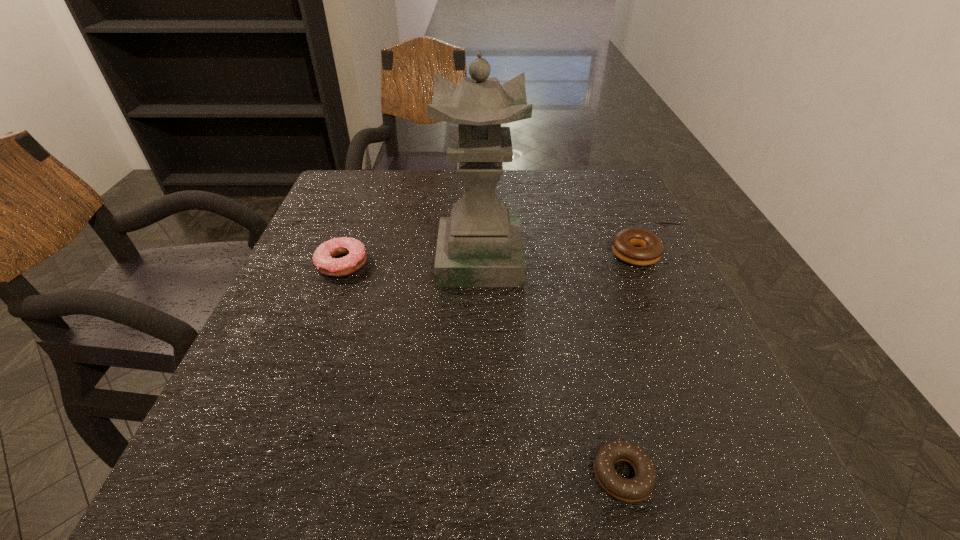
At what (x,y) coordinates should I click in order to perform the action: click on vacant area that lies between the third object from left to right and the leftmost object. Please return your answer as a coordinate pair (x, y). The height and width of the screenshot is (540, 960). Looking at the image, I should click on (483, 369).

Find the location of `unoccupied position between the nearest object and the leftmost doughnut`. unoccupied position between the nearest object and the leftmost doughnut is located at coordinates (483, 369).

Where is `vacant area that lies between the leftmost doughnut and the shortest object`? This screenshot has height=540, width=960. vacant area that lies between the leftmost doughnut and the shortest object is located at coordinates (483, 369).

Locate an element on the screen. This screenshot has width=960, height=540. blank region between the nearest object and the sculpture is located at coordinates (551, 367).

Locate an element on the screen. This screenshot has width=960, height=540. free area in between the second doughnut from left to right and the leftmost object is located at coordinates (483, 369).

You are a GUI agent. You are given a task and a screenshot of the screen. Output one action in this format:
    pyautogui.click(x=<x>, y=<y>)
    Task: Click on the free space that is in between the rightmost object and the shortest object
    Image resolution: width=960 pixels, height=540 pixels.
    Given the screenshot: What is the action you would take?
    pyautogui.click(x=629, y=364)

Choose which object is the nearest neighbor to the sculpture. Please provide its 2D coordinates. Your answer should be formatted as a tuple, i.e. [(x, y)], where the tuple contains the x and y coordinates of a point satisfying the conditions above.

[(323, 258)]

Locate an element on the screen. object that ranks as the third closest to the leftmost object is located at coordinates (638, 488).

Identify the location of doughnut object that ranks as the closest to the rightmost doughnut. The width and height of the screenshot is (960, 540). (638, 488).

Locate an element on the screen. doughnut that is the second closest one to the shortest object is located at coordinates (323, 258).